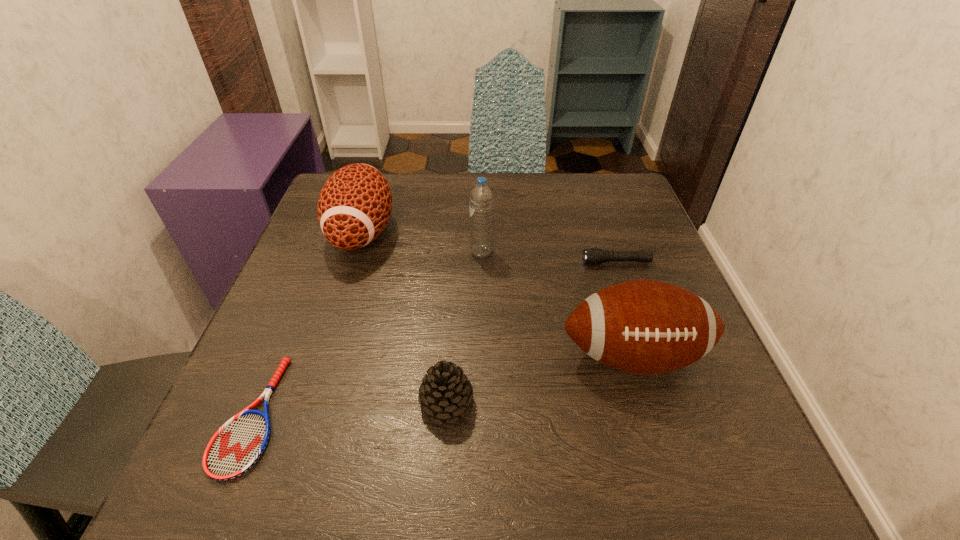
Where is `free point that satisfies the following two spatial constraints: 1. on the laces of the right football; 2. at the narrow end of the pinecone`? free point that satisfies the following two spatial constraints: 1. on the laces of the right football; 2. at the narrow end of the pinecone is located at coordinates (648, 402).

Where is `free space that satisfies the following two spatial constraints: 1. on the front side of the farther football; 2. on the left side of the water bottle`? free space that satisfies the following two spatial constraints: 1. on the front side of the farther football; 2. on the left side of the water bottle is located at coordinates (356, 253).

Find the location of `vacant space that satisfies the following two spatial constraints: 1. on the laces of the nearer football; 2. at the narrow end of the fourth tallest object`. vacant space that satisfies the following two spatial constraints: 1. on the laces of the nearer football; 2. at the narrow end of the fourth tallest object is located at coordinates (648, 402).

Identify the location of vacant area in the image that satisfies the following two spatial constraints: 1. on the laces of the right football; 2. at the narrow end of the third shortest object. The width and height of the screenshot is (960, 540). (648, 402).